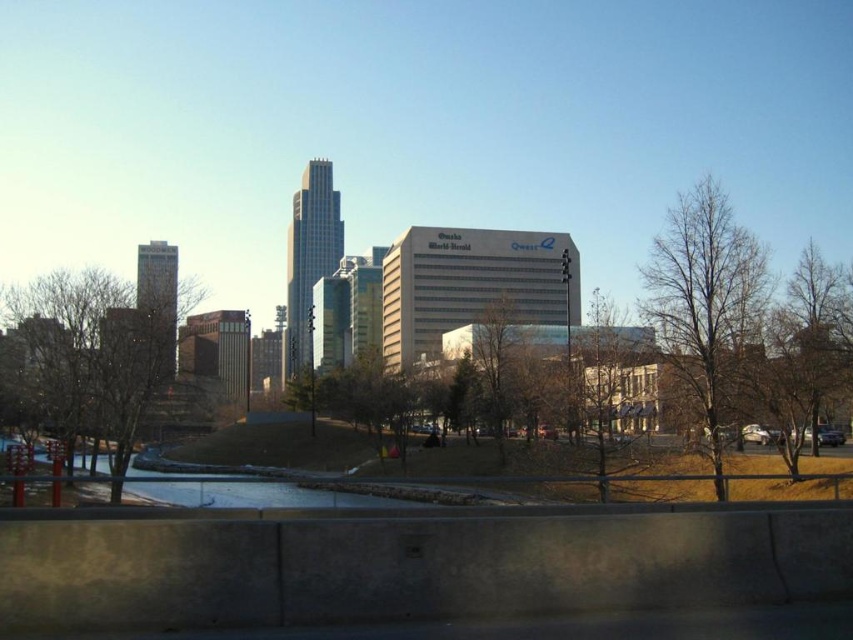
You are standing at the concrete barrier in the foreground of the cityscape. You see two points in the scene labeled as point (41, 330) and point (705, 433). Which point is closer to you?

Point (705, 433) is closer to you because point (41, 330) is behind it.

You are standing at the concrete barrier in the foreground of the cityscape. You see two points in the scene labeled as point [728,211] and point [498,355]. Which point is closer to you?

Point [728,211] is closer to you because it is in front of point [498,355].

You are standing on a bridge overlooking the city. There are two points marked in the scene. Which point is closer to you, point at coordinates (576, 360) or point at coordinates (526, 324)?

Point at coordinates (576, 360) is closer to the viewer than point at coordinates (526, 324).